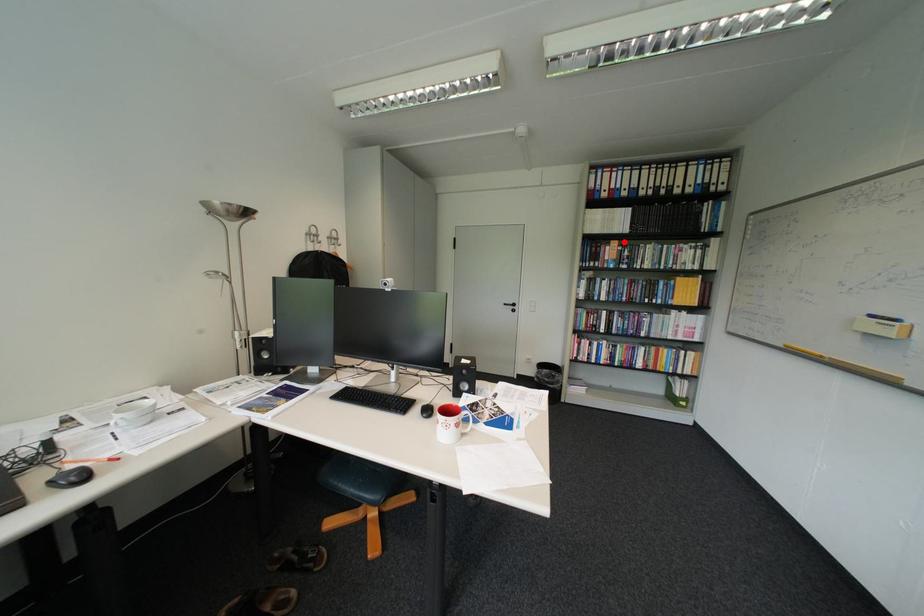
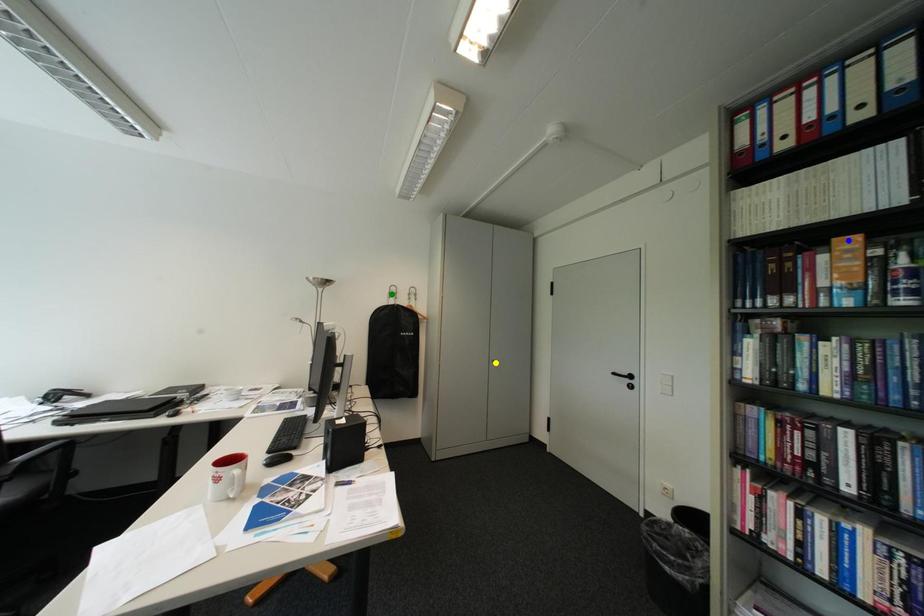
Question: I am providing you with two images of the same scene from different viewpoints. A red point is marked on the first image. You are given multiple points on the second image. Which point in image 2 is actually the same real-world point as the red point in image 1?

Choices:
 (A) yellow point
 (B) green point
 (C) blue point

Answer: (C)